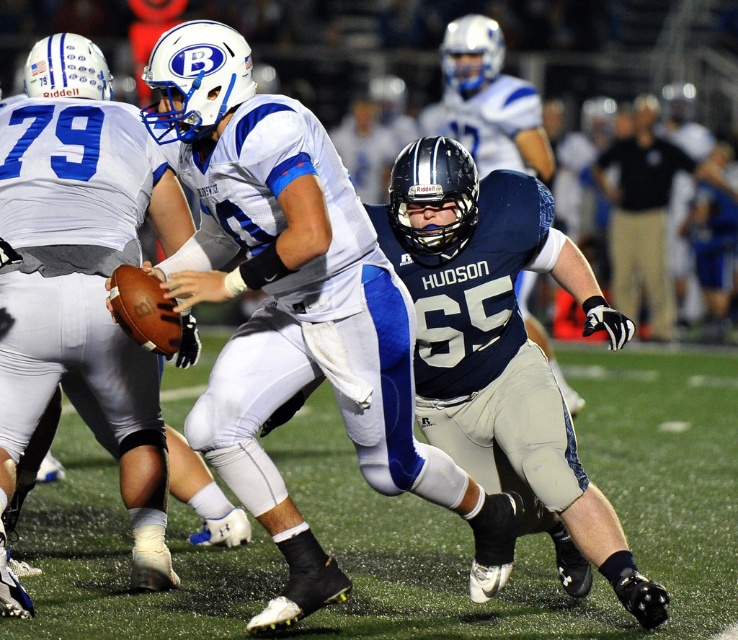
From the picture: You are a spectator sitting in the stands watching the football game. You want to throw a football to the player in white and blue with the number 79, who is at the point marked by coordinates point (620, 618). Can you reach him with a throw of 5 meters?

The distance between you and the point (620, 618) is 5.09 meters. Since your throw reaches 5 meters, you cannot quite reach him as the distance is slightly longer than your throw range.

You are a sports analyst watching the football game. You notice two players wearing the navy blue uniform at center and the dark blue jersey at center. Based on their positions, which player is closer to the ground?

The navy blue uniform at center is below dark blue jersey at center, so the player in the navy blue uniform at center is closer to the ground.